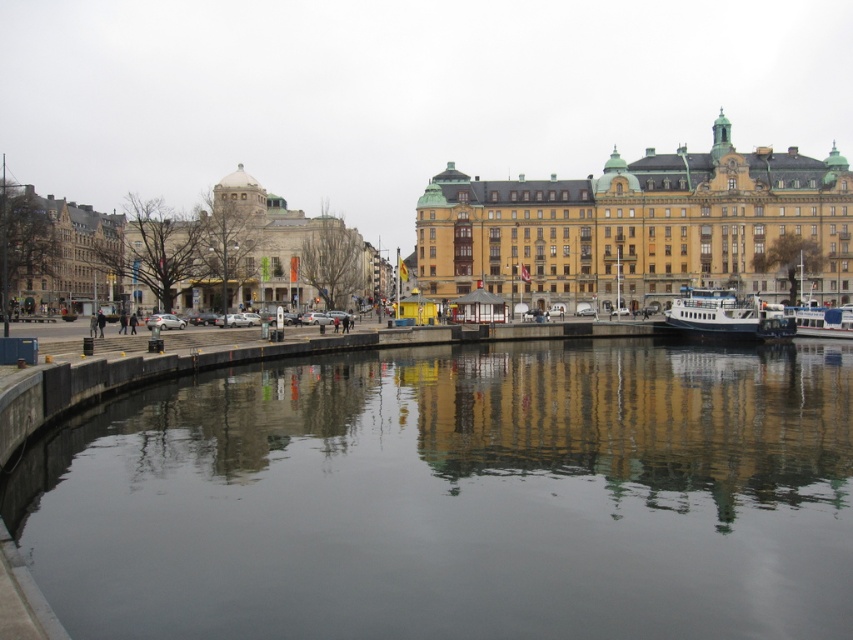
Between smooth concrete river at center and brown stone building at left, which one is positioned higher?

brown stone building at left

Which is behind, point (199, 426) or point (16, 262)?

The point (16, 262) is behind.

Find the location of a particular element. Image resolution: width=853 pixels, height=640 pixels. smooth concrete river at center is located at coordinates (456, 497).

Can you confirm if smooth concrete river at center is positioned to the left of white glossy boat at right?

Yes, smooth concrete river at center is to the left of white glossy boat at right.

Is point (849, 541) closer to viewer compared to point (761, 324)?

Yes, point (849, 541) is in front of point (761, 324).

Who is more forward, (x=670, y=390) or (x=706, y=333)?

Point (x=670, y=390) is in front.

Locate an element on the screen. smooth concrete river at center is located at coordinates (456, 497).

Can you confirm if beige stone building at left is positioned to the left of white glossy boat at right?

Yes, beige stone building at left is to the left of white glossy boat at right.

Is point (202, 285) positioned after point (712, 326)?

Yes.

Locate an element on the screen. Image resolution: width=853 pixels, height=640 pixels. beige stone building at left is located at coordinates (251, 253).